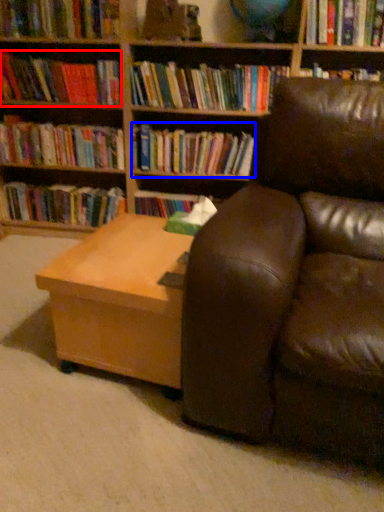
Question: Among these objects, which one is nearest to the camera, book (highlighted by a red box) or book (highlighted by a blue box)?

Choices:
 (A) book
 (B) book

Answer: (A)